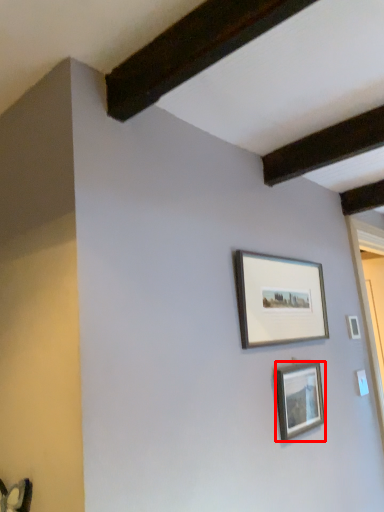
Question: From the image, what is the correct spatial relationship of picture frame (annotated by the red box) in relation to picture frame?

Choices:
 (A) left
 (B) right

Answer: (B)